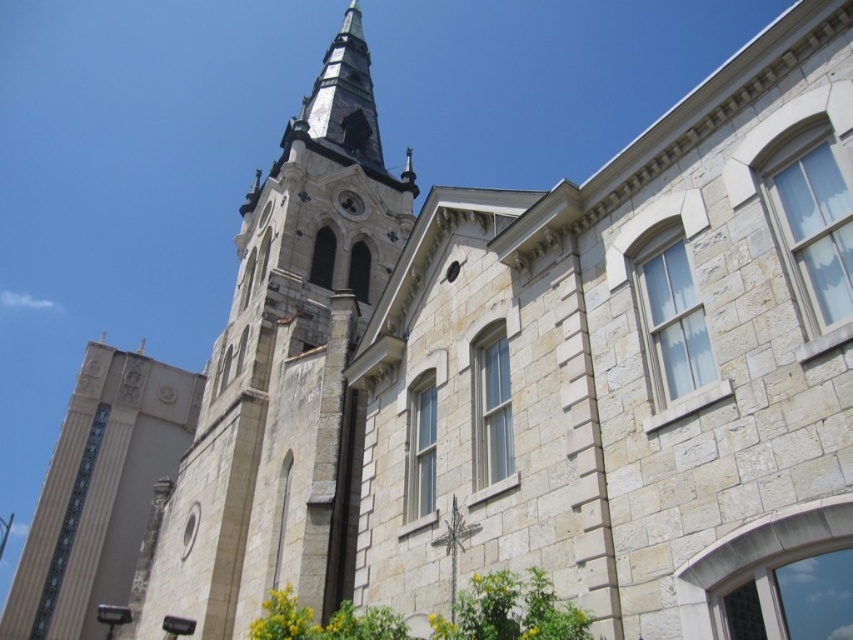
You are an architect examining the historic stone building. You notice the stone steeple at center and the beige stone tower at center. Which of these two structures is larger in size?

The stone steeple at center is bigger than the beige stone tower at center, so the stone steeple at center is larger in size.

You are standing in front of a historic stone building and want to take a photo of the stone steeple at center. If your camera has a maximum zoom range of 100 feet, will you be able to capture the entire steeple in the photo without moving closer?

The stone steeple at center is 138.64 feet away from the viewer. Since the camera can only zoom up to 100 feet, you will not be able to capture the entire steeple without moving closer.